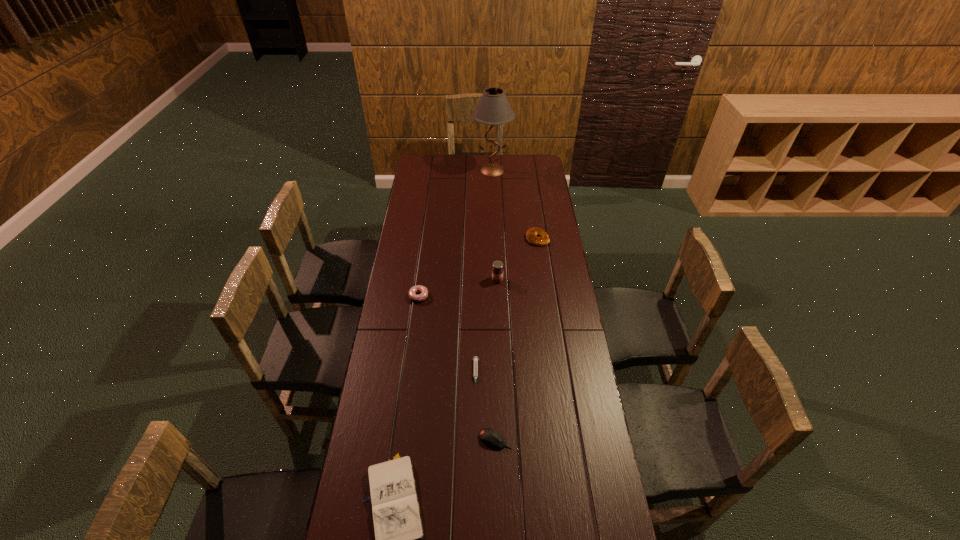
This screenshot has height=540, width=960. Identify the location of vacant position located on the front-facing side of the farthest object. (494, 219).

Locate an element on the screen. The image size is (960, 540). vacant space located on the label side of the sixth shortest object is located at coordinates (499, 318).

Where is `vacant space situated on the front of the rightmost object`? The height and width of the screenshot is (540, 960). vacant space situated on the front of the rightmost object is located at coordinates (541, 265).

The width and height of the screenshot is (960, 540). Identify the location of free space located 0.360m on the back of the fourth nearest object. (426, 237).

Where is `vacant region located on the front of the computer mouse`? This screenshot has width=960, height=540. vacant region located on the front of the computer mouse is located at coordinates (497, 526).

Where is `blank space located 0.100m at the needle end of the fifth farthest object`? Image resolution: width=960 pixels, height=540 pixels. blank space located 0.100m at the needle end of the fifth farthest object is located at coordinates (475, 415).

Where is `object present at the far edge`? This screenshot has height=540, width=960. object present at the far edge is located at coordinates (493, 108).

Find the location of `object located in the left edge section of the desktop`. object located in the left edge section of the desktop is located at coordinates (423, 290).

The width and height of the screenshot is (960, 540). Identify the location of object situated at the right edge. (531, 235).

What are the coordinates of `free point at the far edge` in the screenshot? It's located at (446, 155).